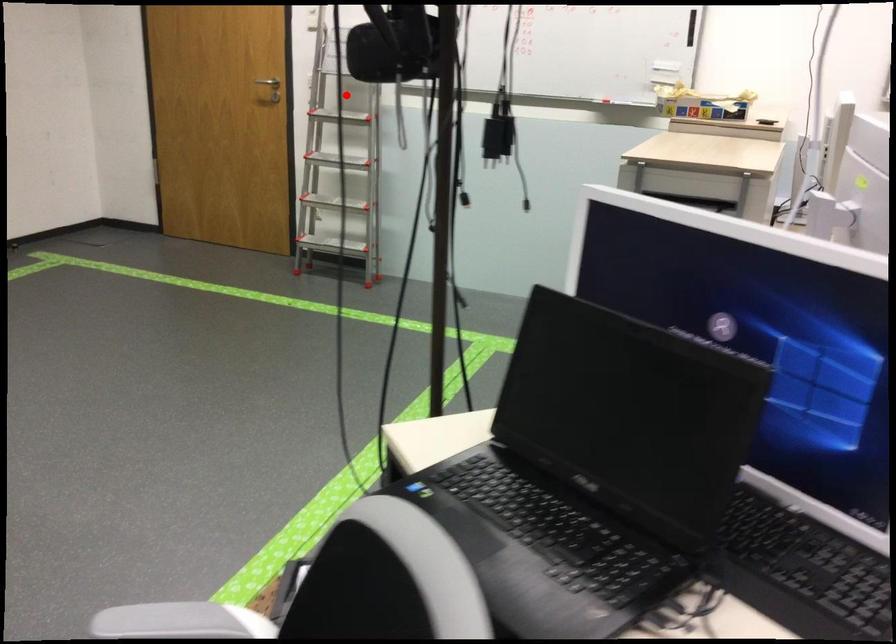
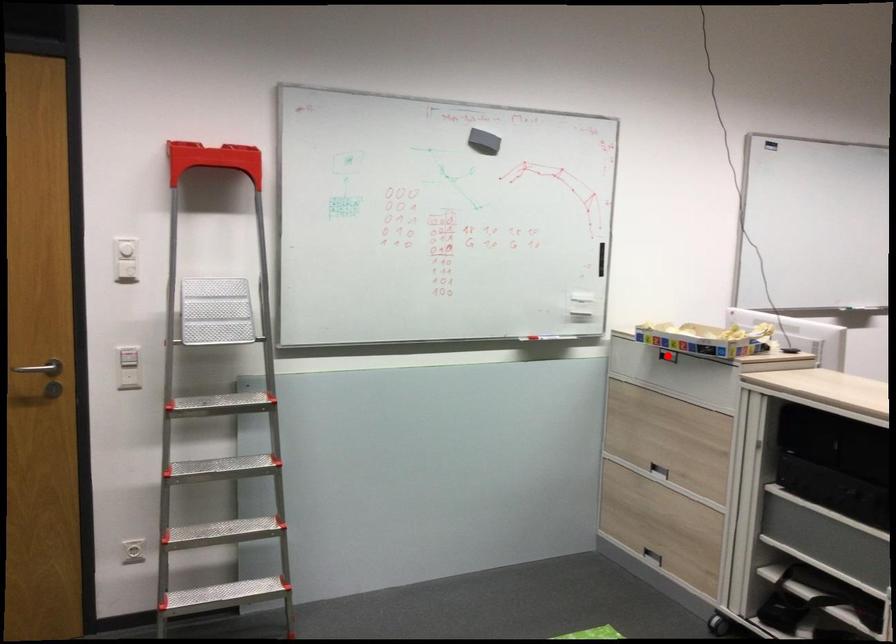
I am providing you with two images of the same scene from different viewpoints. A red point is marked on the first image and another point is marked on the second image. Does the point marked in image1 correspond to the same location as the one in image2?

No